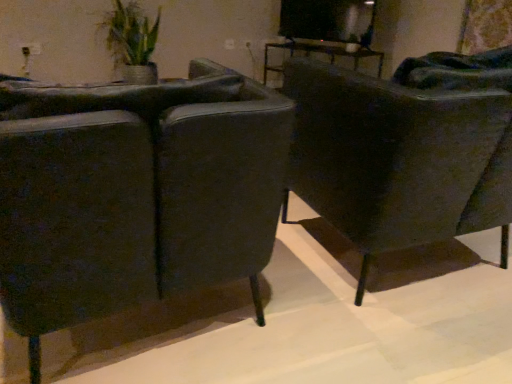
Question: From the image's perspective, is green woven basket at upper left positioned above or below matte black chair at right, the second chair in the left-to-right sequence?

Choices:
 (A) below
 (B) above

Answer: (B)

Question: Is green woven basket at upper left bigger or smaller than matte black chair at right, the second chair in the left-to-right sequence?

Choices:
 (A) small
 (B) big

Answer: (A)

Question: Which of these objects is positioned farthest from the matte black chair at left, the 1th chair viewed from the left?

Choices:
 (A) green woven basket at upper left
 (B) matte black chair at right, the second chair in the left-to-right sequence

Answer: (A)

Question: Which object is the closest to the matte black chair at left, which is counted as the second chair, starting from the right?

Choices:
 (A) green woven basket at upper left
 (B) matte black chair at right, the 1th chair when ordered from right to left

Answer: (B)